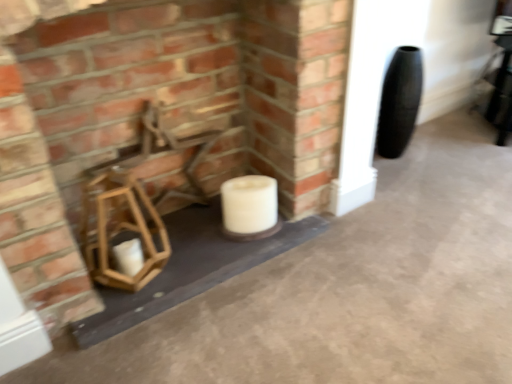
Question: Does wooden lantern at lower left turn towards smooth concrete at center?

Choices:
 (A) yes
 (B) no

Answer: (B)

Question: Does wooden lantern at lower left lie in front of smooth concrete at center?

Choices:
 (A) no
 (B) yes

Answer: (A)

Question: From the image's perspective, is wooden lantern at lower left located beneath smooth concrete at center?

Choices:
 (A) yes
 (B) no

Answer: (B)

Question: From a real-world perspective, is wooden lantern at lower left on smooth concrete at center?

Choices:
 (A) yes
 (B) no

Answer: (A)

Question: Is wooden lantern at lower left positioned beyond the bounds of smooth concrete at center?

Choices:
 (A) yes
 (B) no

Answer: (A)

Question: From the image's perspective, is wooden chair at center located above or below white matte candle at center?

Choices:
 (A) above
 (B) below

Answer: (A)

Question: Is point click(x=88, y=216) closer or farther from the camera than point click(x=228, y=210)?

Choices:
 (A) closer
 (B) farther

Answer: (A)

Question: From a real-world perspective, relative to white matte candle at center, is wooden chair at center vertically above or below?

Choices:
 (A) above
 (B) below

Answer: (A)

Question: Would you say wooden chair at center is to the left or to the right of white matte candle at center in the picture?

Choices:
 (A) right
 (B) left

Answer: (B)

Question: From the image's perspective, relative to wooden chair at center, is wooden lantern at lower left above or below?

Choices:
 (A) below
 (B) above

Answer: (B)

Question: In the image, is wooden lantern at lower left positioned in front of or behind wooden chair at center?

Choices:
 (A) front
 (B) behind

Answer: (A)

Question: From a real-world perspective, is wooden lantern at lower left physically located above or below wooden chair at center?

Choices:
 (A) below
 (B) above

Answer: (B)

Question: Considering the positions of wooden lantern at lower left and wooden chair at center in the image, is wooden lantern at lower left taller or shorter than wooden chair at center?

Choices:
 (A) tall
 (B) short

Answer: (A)

Question: In terms of width, does wooden lantern at lower left look wider or thinner when compared to smooth concrete at center?

Choices:
 (A) thin
 (B) wide

Answer: (A)

Question: Is wooden lantern at lower left in front of or behind smooth concrete at center in the image?

Choices:
 (A) front
 (B) behind

Answer: (B)